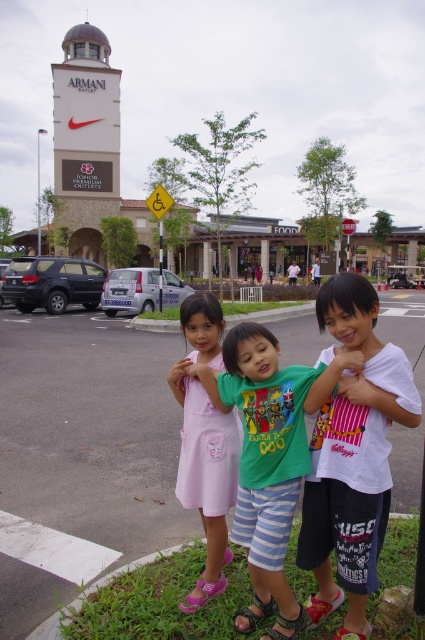
Can you confirm if white cotton shirt at center is smaller than pink fabric dress at center?

No.

Can you confirm if white cotton shirt at center is bigger than pink fabric dress at center?

Yes.

Image resolution: width=425 pixels, height=640 pixels. Describe the element at coordinates (353, 456) in the screenshot. I see `white cotton shirt at center` at that location.

Find the location of `white cotton shirt at center`. white cotton shirt at center is located at coordinates (353, 456).

How much distance is there between green cotton shirt at center and white concrete clock tower at upper left?

55.16 meters

From the picture: Can you confirm if green cotton shirt at center is taller than white concrete clock tower at upper left?

No.

Is point (251, 500) positioned after point (113, 196)?

No, it is not.

Identify the location of green cotton shirt at center. This screenshot has width=425, height=640. (269, 460).

Does white concrete clock tower at upper left come behind pink fabric dress at center?

Yes, it is.

The height and width of the screenshot is (640, 425). What do you see at coordinates (85, 138) in the screenshot? I see `white concrete clock tower at upper left` at bounding box center [85, 138].

In order to click on white concrete clock tower at upper left in this screenshot , I will do `click(85, 138)`.